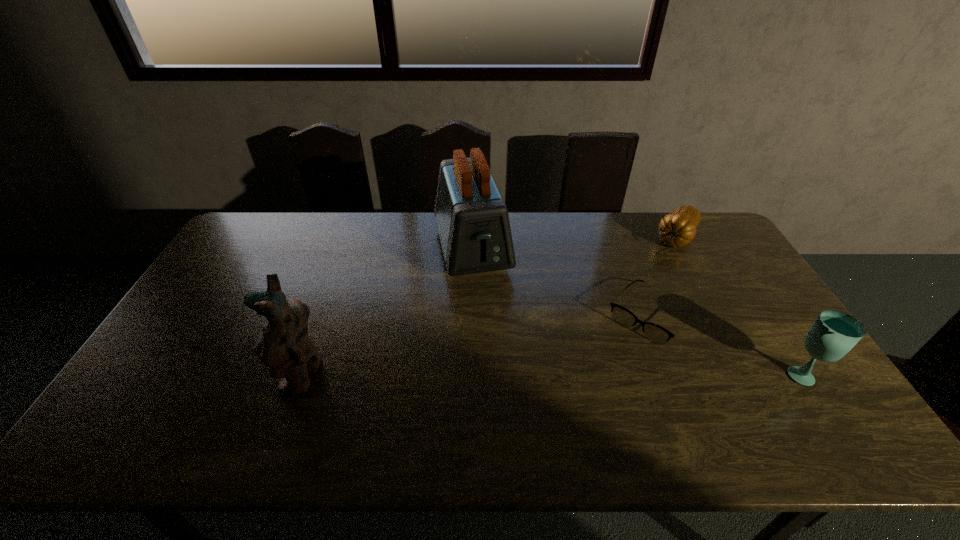
In the image, there is a desktop. At what (x,y) coordinates should I click in order to perform the action: click on vacant space at the right edge. Please return your answer as a coordinate pair (x, y). The image size is (960, 540). Looking at the image, I should click on (735, 330).

I want to click on free space at the far left corner of the desktop, so click(262, 212).

Where is `free region at the near left corner of the desktop`? Image resolution: width=960 pixels, height=540 pixels. free region at the near left corner of the desktop is located at coordinates (132, 403).

Locate an element on the screen. The width and height of the screenshot is (960, 540). free spot between the rightmost object and the toaster is located at coordinates (637, 312).

The width and height of the screenshot is (960, 540). In order to click on vacant point located between the gourd and the rightmost object in this screenshot , I will do `click(740, 306)`.

Identify the location of empty space between the spectacles and the second shortest object. The image size is (960, 540). (663, 276).

Identify the location of free space that is in between the second object from left to right and the spectacles. (561, 282).

At what (x,y) coordinates should I click in order to perform the action: click on free space between the second shortest object and the figurine. Please return your answer as a coordinate pair (x, y). The width and height of the screenshot is (960, 540). Looking at the image, I should click on (490, 306).

Locate an element on the screen. This screenshot has height=540, width=960. empty location between the third shortest object and the gourd is located at coordinates (740, 306).

Locate an element on the screen. free point between the rightmost object and the second object from left to right is located at coordinates (637, 312).